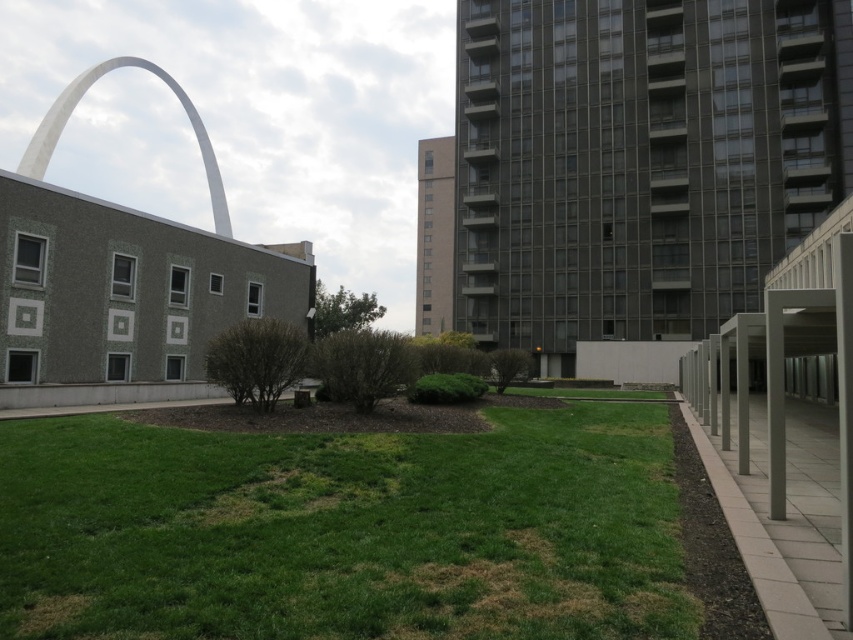
You are a city planner evaluating the space between the green grass at center and the white smooth arch at upper left. Given that the grass area is narrower than the arch, can you confirm if the grass is positioned to the left or right of the arch?

The green grass at center is positioned to the left of the white smooth arch at upper left because its width is less than the arch, indicating it occupies a smaller area on the left side.

You are standing at the point labeled as point (344, 531) in the image. What is the immediate surface you are standing on?

The immediate surface at point (344, 531) is green grass at center.

You are a city planner reviewing the urban landscape. You need to determine the spatial relationship between the green grass at center and the white smooth arch at upper left. Which object is located to the right of the other?

The green grass at center is positioned on the right side of white smooth arch at upper left.